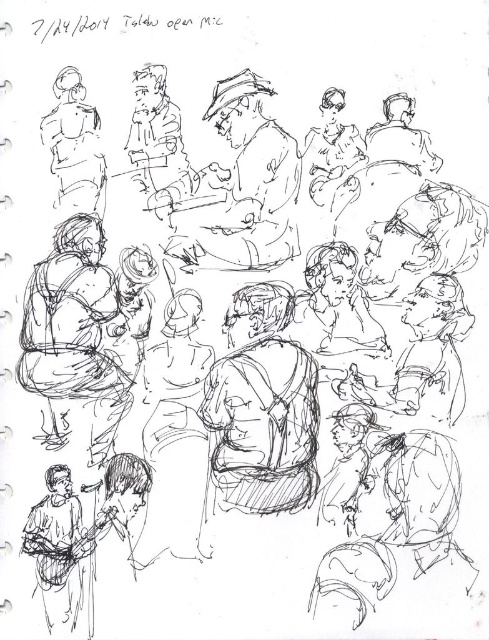
Question: Which point appears farthest from the camera in this image?

Choices:
 (A) (191, 204)
 (B) (78, 131)

Answer: (A)

Question: Is smooth brown jacket at center smaller than matte black figure at upper left?

Choices:
 (A) no
 (B) yes

Answer: (A)

Question: Can you confirm if smooth brown jacket at center is thinner than matte black figure at upper left?

Choices:
 (A) no
 (B) yes

Answer: (A)

Question: Does smooth brown jacket at center appear over matte black figure at upper left?

Choices:
 (A) yes
 (B) no

Answer: (B)